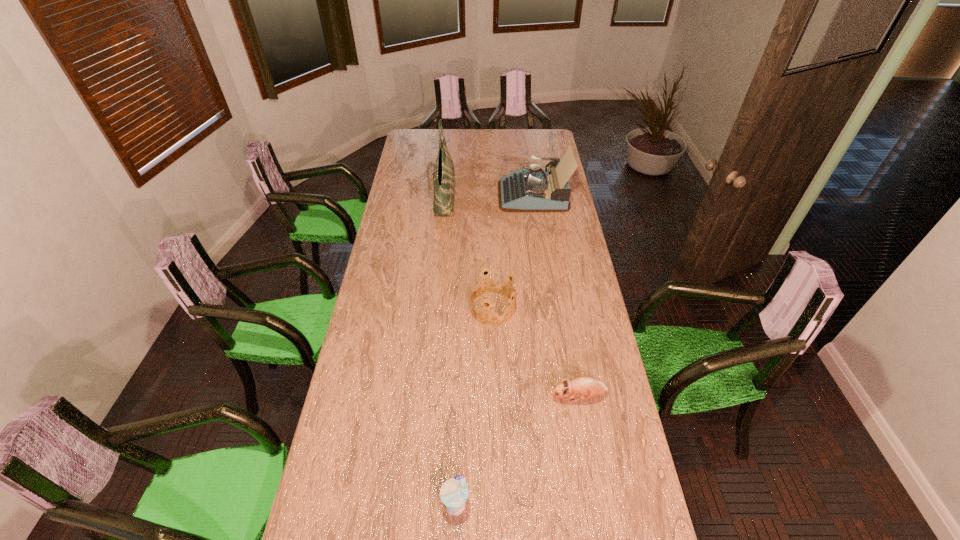
At what (x,y) coordinates should I click in order to perform the action: click on empty space that is in between the crown and the fourth farthest object. Please return your answer as a coordinate pair (x, y). Looking at the image, I should click on (536, 353).

Locate an element on the screen. The width and height of the screenshot is (960, 540). object that ranks as the closest to the crown is located at coordinates (584, 387).

Identify which object is the third nearest to the fourth shortest object. Please provide its 2D coordinates. Your answer should be formatted as a tuple, i.e. [(x, y)], where the tuple contains the x and y coordinates of a point satisfying the conditions above.

[(584, 387)]

Identify the location of vacant space that satisfies the following two spatial constraints: 1. on the typing side of the fourth shortest object; 2. on the front side of the crown. (550, 309).